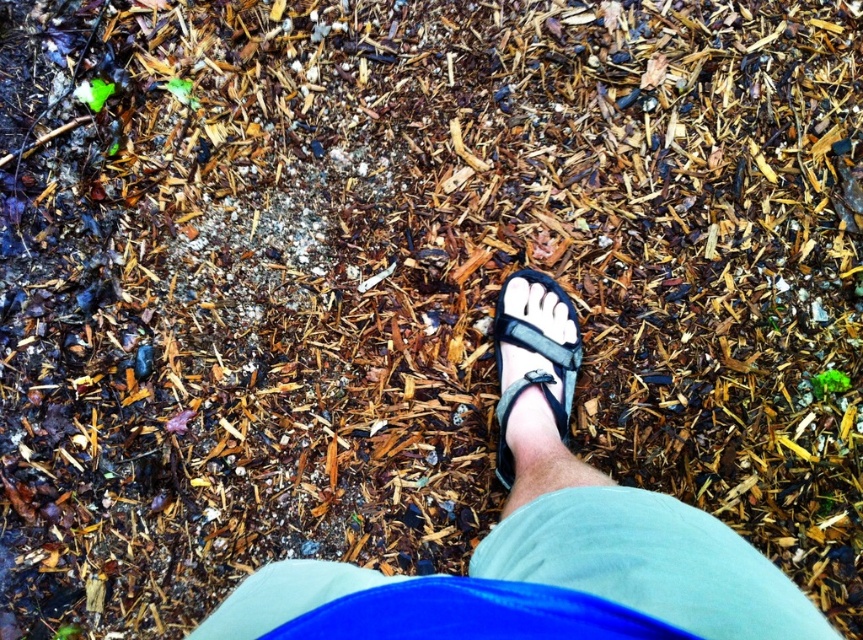
You are a delivery robot navigating through a forest path. You need to place a package on the ground near the black fabric sandal at center. Given the coordinates provided in the Objects Description, can you confirm if the sandal is positioned in a stable area free of large debris?

The black fabric sandal at center is located at coordinates point [542,538]. Since the ground around it is described as uneven with wood chips and small debris, placing the package there may be unstable due to the scattered materials. Choose a flatter area nearby.

You are trying to choose between the black fabric sandal at center and the black leather sandal at center to place on the ground covered with wood chips and small debris. Based on their width, which one might leave a wider footprint in the ground?

The black fabric sandal at center might be wider than the black leather sandal at center, so it would leave a wider footprint in the ground.

Consider the image. You are a hiker who just finished a trail and wants to pick up one of your sandals to put it on. You see the black fabric sandal at center and the black leather sandal at center. Which one is closer to your current position?

The black fabric sandal at center is 8.46 inches away from the black leather sandal at center, so whichever sandal you are closer to depends on their positions relative to your current spot. However, since both are at the center, they might be equally distant unless there is an exact measurement provided.